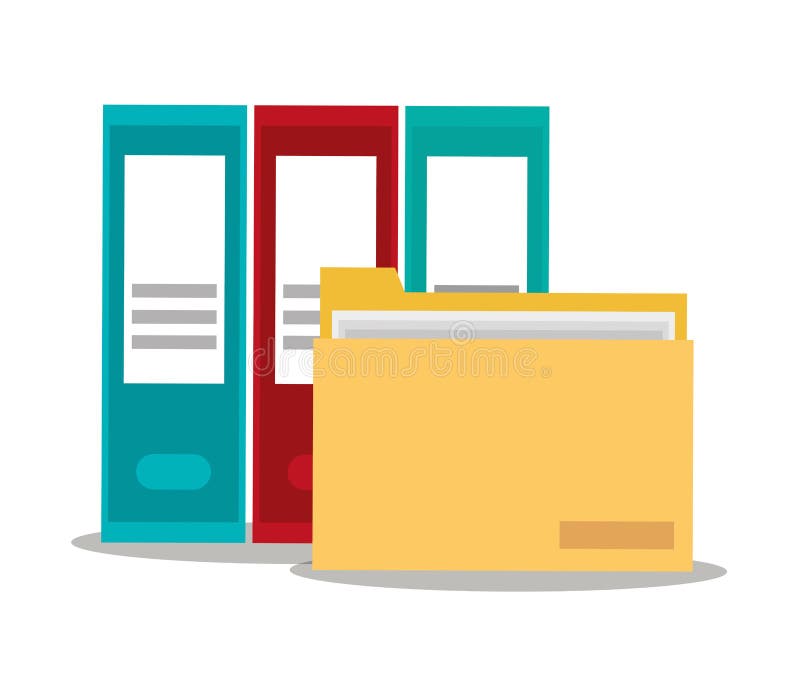
This screenshot has height=697, width=800. In order to click on grey lines on left book in this screenshot , I will do `click(162, 291)`, `click(174, 316)`, `click(170, 344)`.